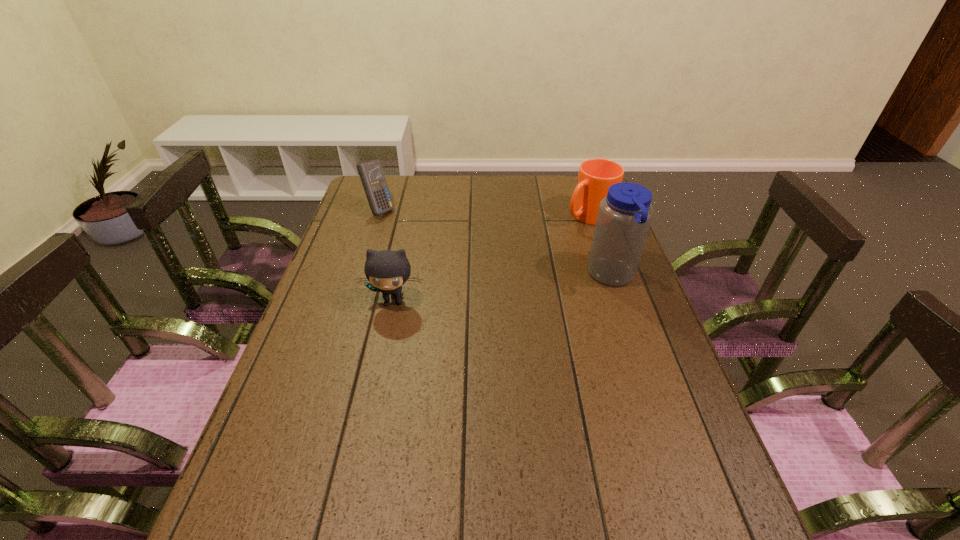
This screenshot has height=540, width=960. In order to click on object that is at the far left corner in this screenshot , I will do `click(371, 174)`.

The height and width of the screenshot is (540, 960). What are the coordinates of `object that is at the far right corner` in the screenshot? It's located at (595, 176).

In the image, there is a desktop. Where is `vacant space at the left edge`? vacant space at the left edge is located at coordinates pyautogui.click(x=293, y=433).

The height and width of the screenshot is (540, 960). Find the location of `vacant space at the right edge`. vacant space at the right edge is located at coordinates (571, 218).

Identify the location of free region at the far left corner. (390, 180).

Find the location of a particular element. Image resolution: width=960 pixels, height=540 pixels. free spot at the far right corner of the desktop is located at coordinates (565, 204).

In the image, there is a desktop. At what (x,y) coordinates should I click in order to perform the action: click on vacant space at the near right corner. Please return your answer as a coordinate pair (x, y). Looking at the image, I should click on (x=684, y=494).

Image resolution: width=960 pixels, height=540 pixels. I want to click on blank region between the mug and the kitten, so click(x=492, y=258).

I want to click on vacant space in between the water bottle and the kitten, so click(503, 288).

Locate an element on the screen. The image size is (960, 540). vacant space that is in between the calculator and the water bottle is located at coordinates (495, 243).